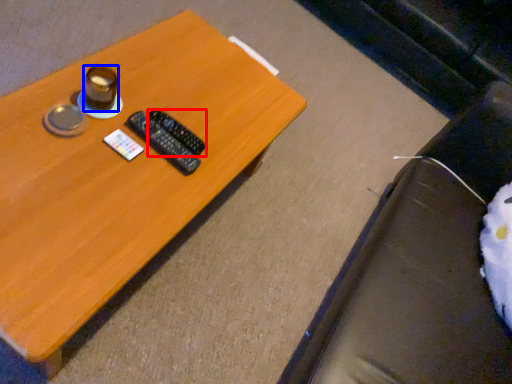
Question: Which object appears farthest to the camera in this image, remote control (highlighted by a red box) or coffee cup (highlighted by a blue box)?

Choices:
 (A) remote control
 (B) coffee cup

Answer: (A)